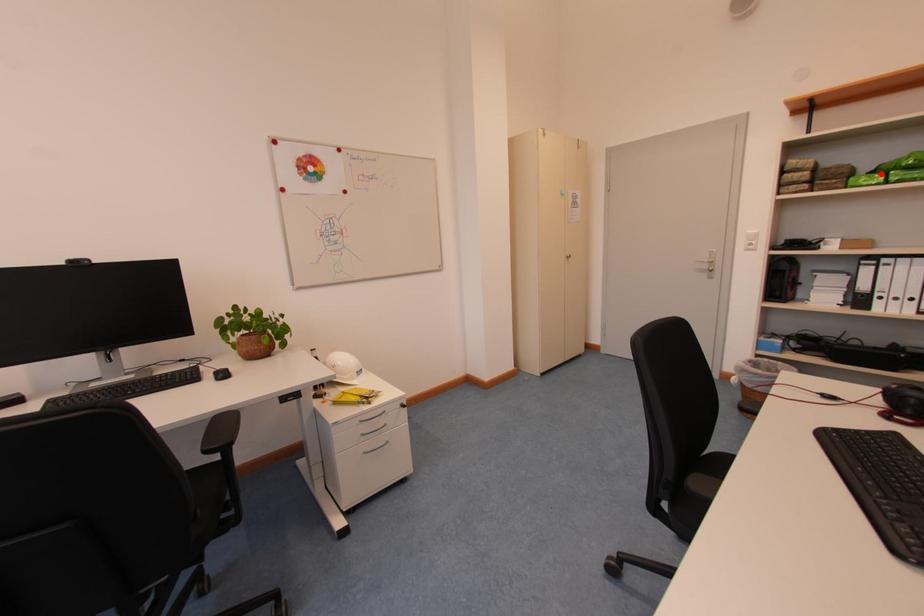
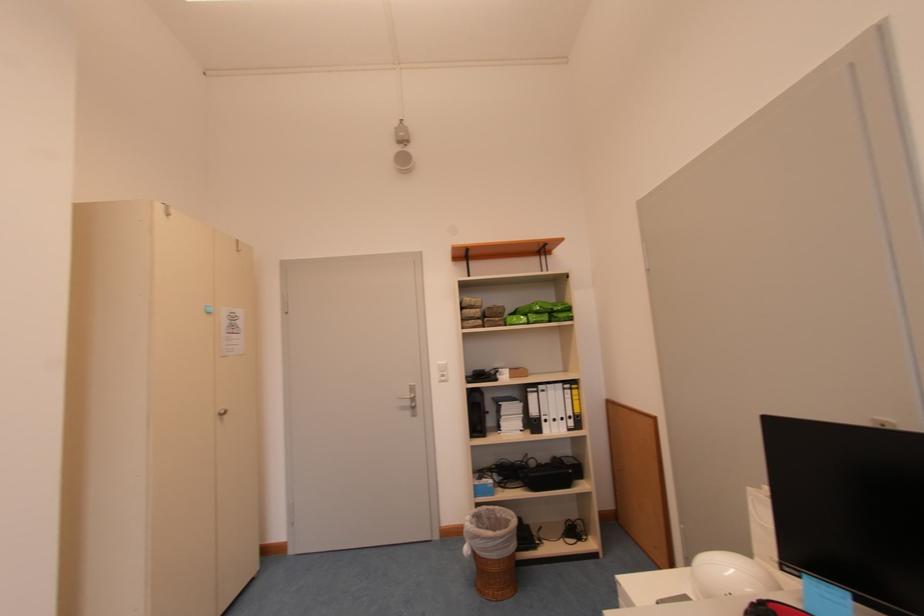
In the second image, find the point that corresponds to the highlighted location in the first image.

(521, 315)